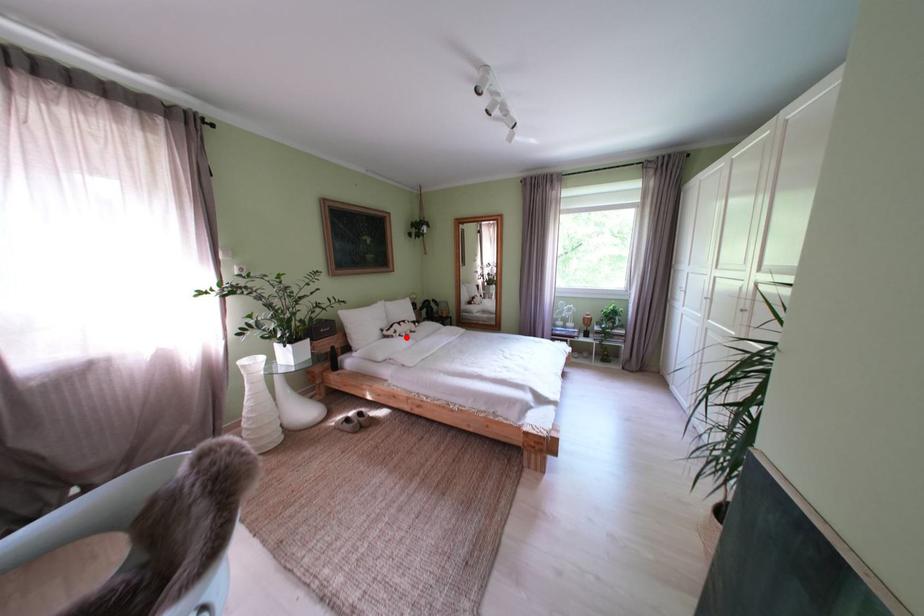
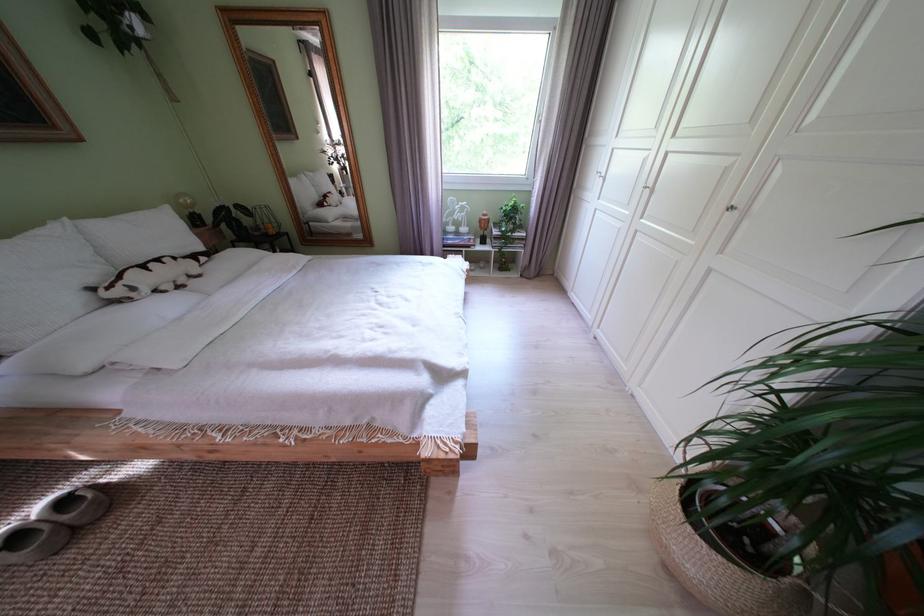
Question: I am providing you with two images of the same scene from different viewpoints. A red point is marked on the first image. Can you still see the location of the red point in image 2?

Choices:
 (A) Yes
 (B) No

Answer: (A)